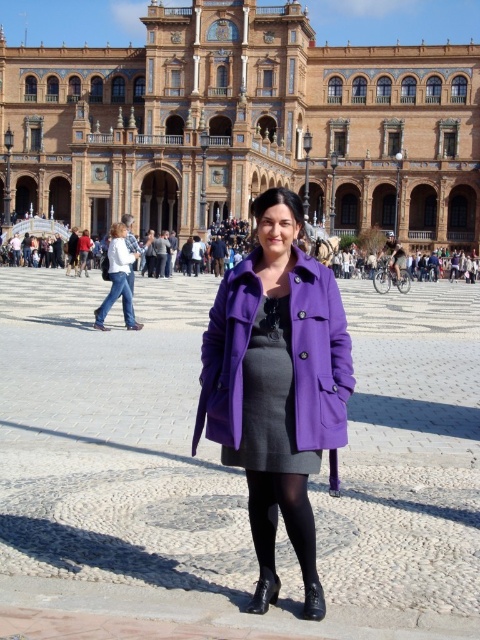
Looking at this image, you are a photographer trying to capture a detailed shot of both the black tights at center and the denim jeans at left. Since you can only focus on one object at a time, which one should you choose to ensure it appears clearer in the photo?

The black tights at center has a smaller size compared to denim jeans at left, so focusing on the black tights at center will ensure it appears clearer in the photo.

Please provide the coordinates of the matte gray dress at center in the image.

The coordinates of the matte gray dress at center are at point (269,397).